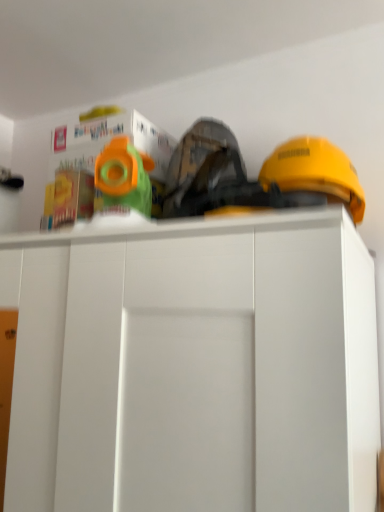
Question: Does matte plastic toy at upper left, positioned as the 1th toy in left-to-right order, have a greater width compared to green plastic toy at upper center, arranged as the second toy when viewed from the left?

Choices:
 (A) no
 (B) yes

Answer: (A)

Question: Is matte plastic toy at upper left, the 2th toy in the right-to-left sequence, beside green plastic toy at upper center, arranged as the second toy when viewed from the left?

Choices:
 (A) yes
 (B) no

Answer: (B)

Question: Is matte plastic toy at upper left, the 2th toy in the right-to-left sequence, positioned in front of green plastic toy at upper center, which ranks as the first toy in right-to-left order?

Choices:
 (A) yes
 (B) no

Answer: (B)

Question: Are matte plastic toy at upper left, positioned as the 1th toy in left-to-right order, and green plastic toy at upper center, which ranks as the first toy in right-to-left order, located far from each other?

Choices:
 (A) yes
 (B) no

Answer: (B)

Question: Is matte plastic toy at upper left, the 2th toy in the right-to-left sequence, oriented towards green plastic toy at upper center, which ranks as the first toy in right-to-left order?

Choices:
 (A) no
 (B) yes

Answer: (A)

Question: From a real-world perspective, does matte plastic toy at upper left, positioned as the 1th toy in left-to-right order, stand above green plastic toy at upper center, which ranks as the first toy in right-to-left order?

Choices:
 (A) no
 (B) yes

Answer: (B)

Question: Does matte plastic toy at upper left, the 2th toy in the right-to-left sequence, have a smaller size compared to white matte cabinet at center?

Choices:
 (A) no
 (B) yes

Answer: (B)

Question: Is white matte cabinet at center a part of matte plastic toy at upper left, the 2th toy in the right-to-left sequence?

Choices:
 (A) yes
 (B) no

Answer: (B)

Question: Is matte plastic toy at upper left, positioned as the 1th toy in left-to-right order, behind white matte cabinet at center?

Choices:
 (A) yes
 (B) no

Answer: (A)

Question: Does matte plastic toy at upper left, the 2th toy in the right-to-left sequence, touch white matte cabinet at center?

Choices:
 (A) yes
 (B) no

Answer: (B)

Question: From a real-world perspective, is matte plastic toy at upper left, the 2th toy in the right-to-left sequence, positioned under white matte cabinet at center based on gravity?

Choices:
 (A) yes
 (B) no

Answer: (B)

Question: Is matte plastic toy at upper left, the 2th toy in the right-to-left sequence, aimed at white matte cabinet at center?

Choices:
 (A) yes
 (B) no

Answer: (B)

Question: Does green plastic toy at upper center, which ranks as the first toy in right-to-left order, appear on the left side of matte plastic toy at upper left, positioned as the 1th toy in left-to-right order?

Choices:
 (A) yes
 (B) no

Answer: (B)